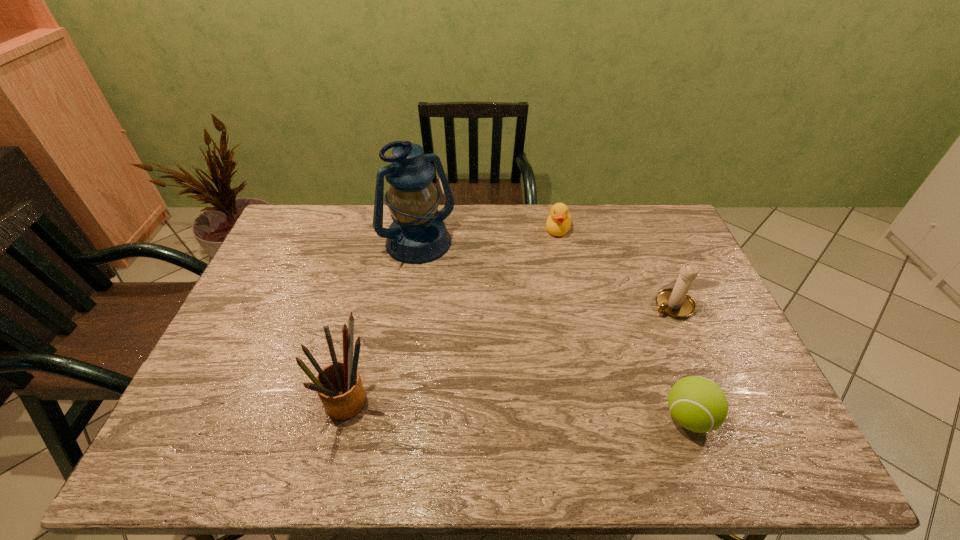
Identify the location of tennis ball at the near edge. (698, 404).

Locate an element on the screen. The width and height of the screenshot is (960, 540). tennis ball situated at the right edge is located at coordinates (698, 404).

Identify the location of candle holder at the right edge. (676, 303).

Where is `object present at the near right corner`? object present at the near right corner is located at coordinates (698, 404).

In the image, there is a desktop. In order to click on vacant area at the far edge in this screenshot , I will do `click(525, 224)`.

At what (x,y) coordinates should I click in order to perform the action: click on vacant space at the near edge. Please return your answer as a coordinate pair (x, y). Looking at the image, I should click on (524, 420).

Identify the location of vacant region at the left edge of the desktop. This screenshot has height=540, width=960. (307, 254).

The width and height of the screenshot is (960, 540). In the image, there is a desktop. Find the location of `blank space at the right edge`. blank space at the right edge is located at coordinates (716, 319).

The width and height of the screenshot is (960, 540). In the image, there is a desktop. Identify the location of free space at the far left corner. (296, 211).

Find the location of a particular element. vacant space at the near left corner of the desktop is located at coordinates (215, 407).